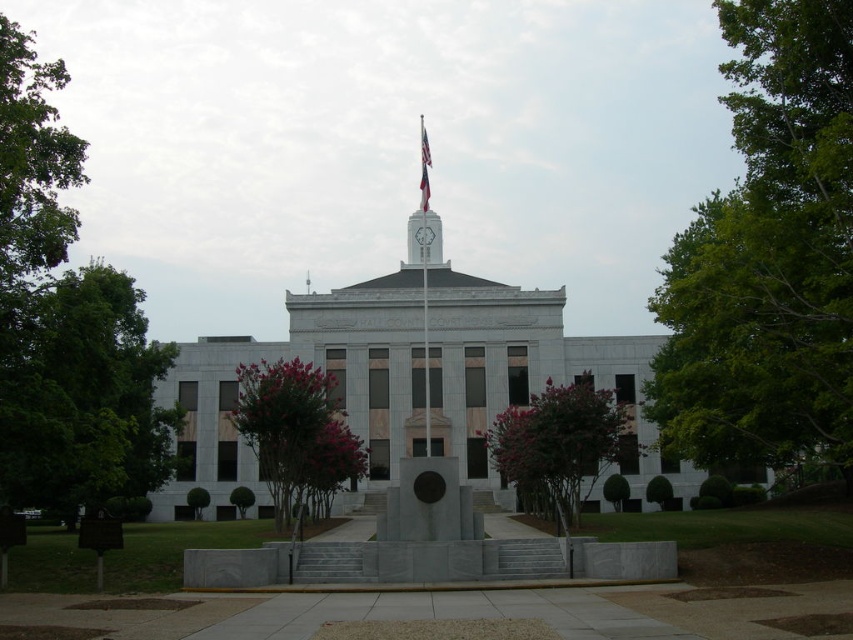
How much distance is there between green leafy tree at left and purple leafy tree at center?

A distance of 31.72 meters exists between green leafy tree at left and purple leafy tree at center.

Is the position of green leafy tree at left less distant than that of purple leafy tree at center?

Yes, green leafy tree at left is in front of purple leafy tree at center.

What are the coordinates of `green leafy tree at left` in the screenshot? It's located at (80, 394).

Which of these two, green leafy tree at right or white fabric flag at center, stands shorter?

white fabric flag at center

Between point (751, 109) and point (425, 166), which one is positioned behind?

Positioned behind is point (425, 166).

I want to click on green leafy tree at right, so click(x=769, y=256).

Which of these two, purple leafy tree at center or metallic flag pole at center, stands shorter?

purple leafy tree at center is shorter.

Which is behind, point (523, 435) or point (422, 305)?

Positioned behind is point (422, 305).

Between point (548, 483) and point (422, 124), which one is positioned behind?

Point (422, 124)

You are a GUI agent. You are given a task and a screenshot of the screen. Output one action in this format:
    pyautogui.click(x=<x>, y=<y>)
    Task: Click on the purple leafy tree at center
    
    Given the screenshot: What is the action you would take?
    pyautogui.click(x=560, y=444)